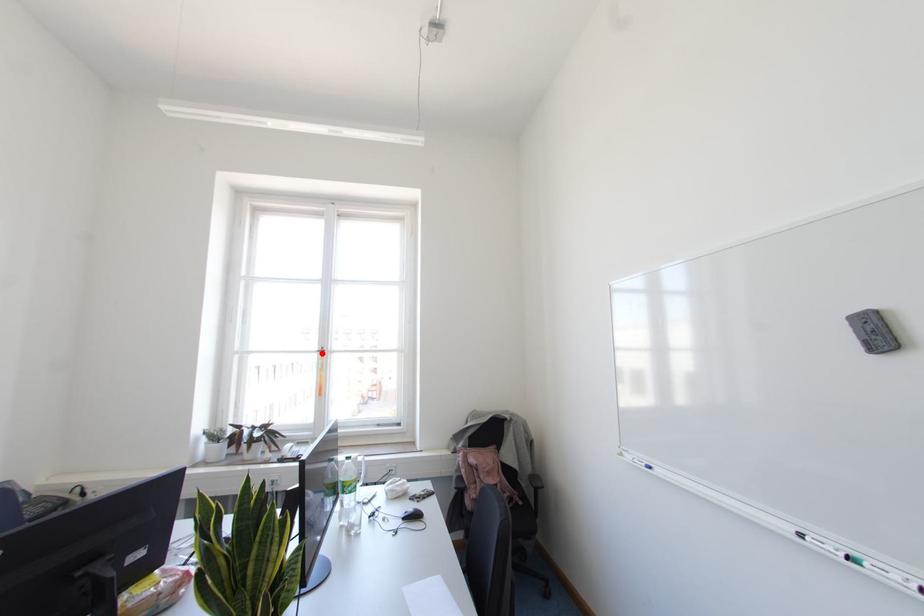
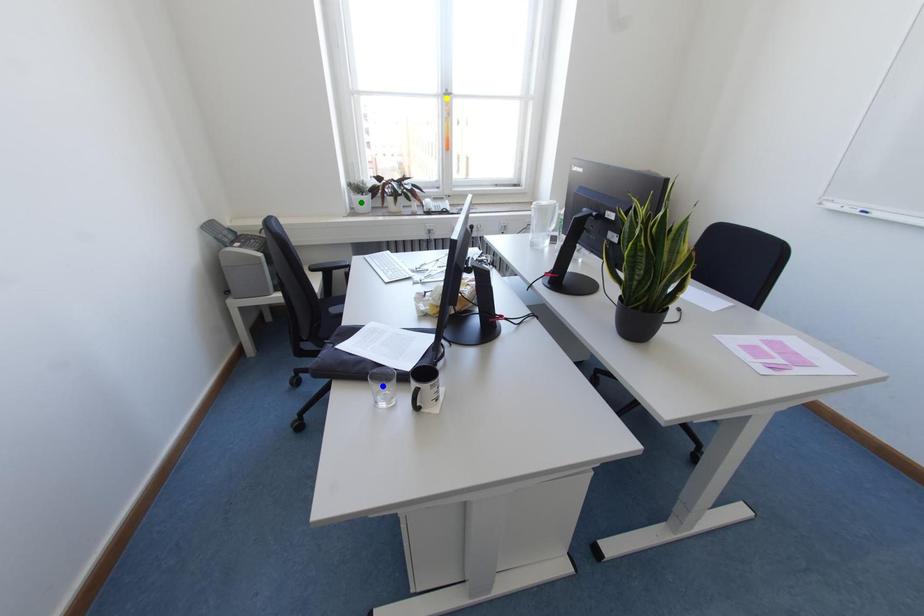
Question: I am providing you with two images of the same scene from different viewpoints. A red point is marked on the first image. You are given multiple points on the second image. Which mark in image 2 goes with the point in image 1?

Choices:
 (A) yellow point
 (B) green point
 (C) blue point

Answer: (A)